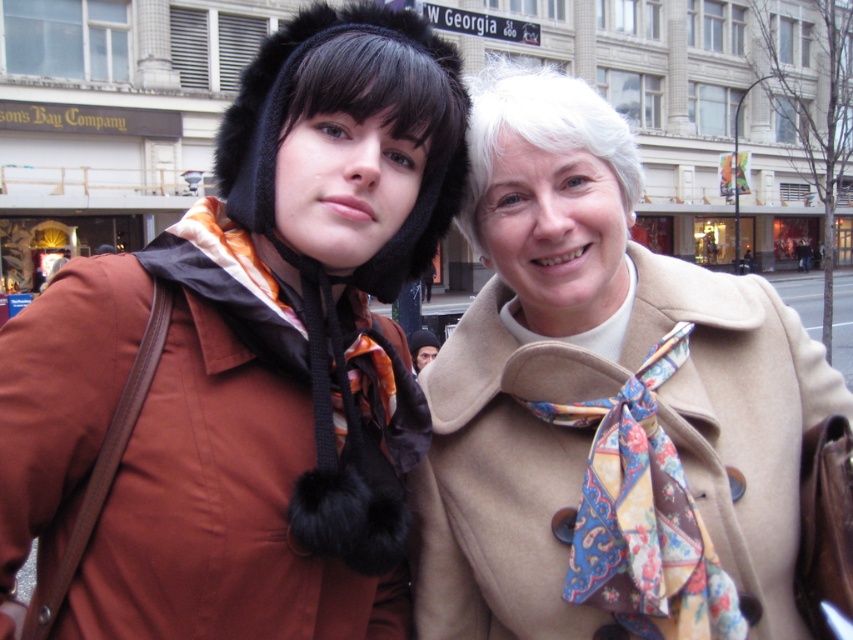
You are taking a photo of two points in the image. The first point is labeled as point (613, 577) and the second is point (438, 20). Which point is closer to your camera?

Point (613, 577) is closer to the camera than point (438, 20).

You are a photographer trying to capture both the paisley silk scarf at center and the white plastic street sign at upper center in a single frame. Based on their sizes, which object would you need to position closer to the camera to ensure both fit within the frame?

Since the paisley silk scarf at center is smaller than the white plastic street sign at upper center, you should position the paisley silk scarf at center closer to the camera to balance their sizes in the frame.

Based on the photo, you are a photographer trying to capture both the beige woolen coat at right and the white plastic street sign at upper center in a single frame. Given their sizes, which object should you zoom in on to ensure both fit comfortably in the photo?

Since the beige woolen coat at right is narrower than the white plastic street sign at upper center, you should zoom in on the white plastic street sign at upper center to ensure both fit comfortably in the photo.